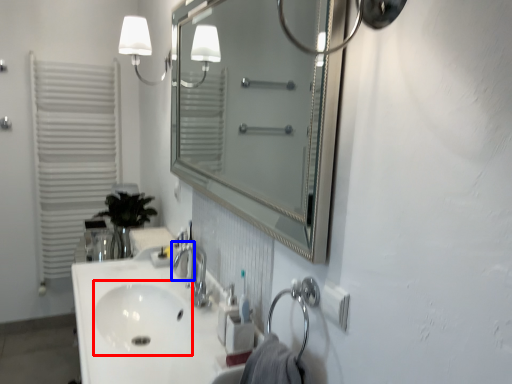
Question: Which point is further to the camera, sink (highlighted by a red box) or faucet (highlighted by a blue box)?

Choices:
 (A) sink
 (B) faucet

Answer: (B)